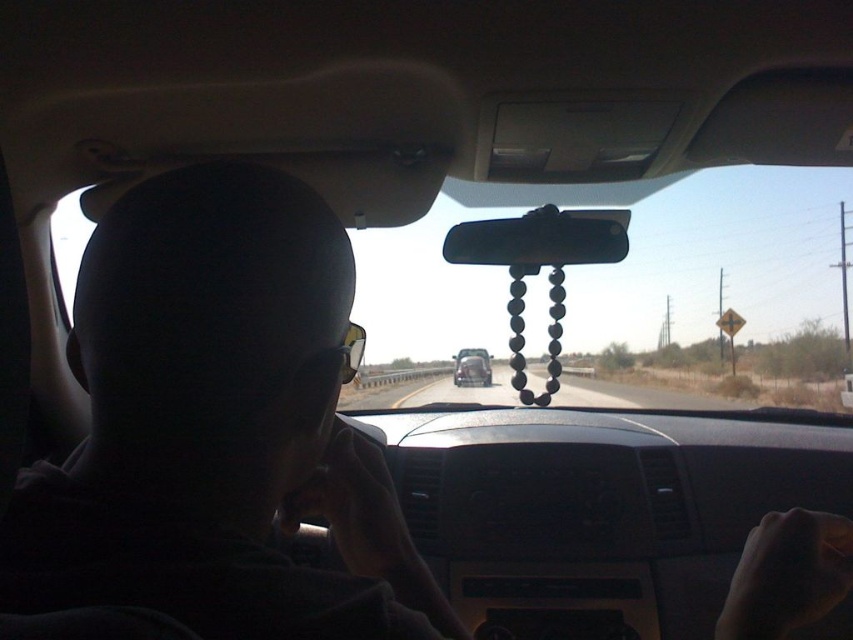
You are sitting in the driver seat of the vehicle shown. You notice two points on the road ahead through the windshield. The first point is at coordinates point (601, 256) and the second is at point (479, 356). Which point is closer to you?

Point (601, 256) is closer to the viewer than point (479, 356).